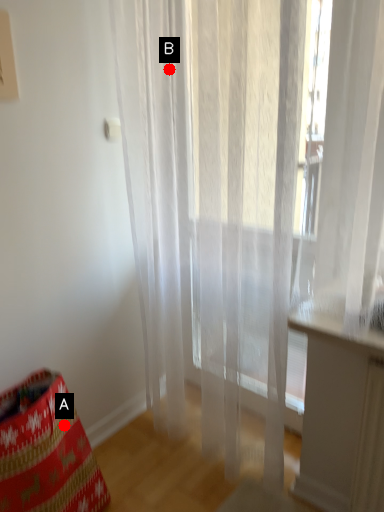
Question: Two points are circled on the image, labeled by A and B beside each circle. Which of the following is the closest to the observer?

Choices:
 (A) A is closer
 (B) B is closer

Answer: (B)